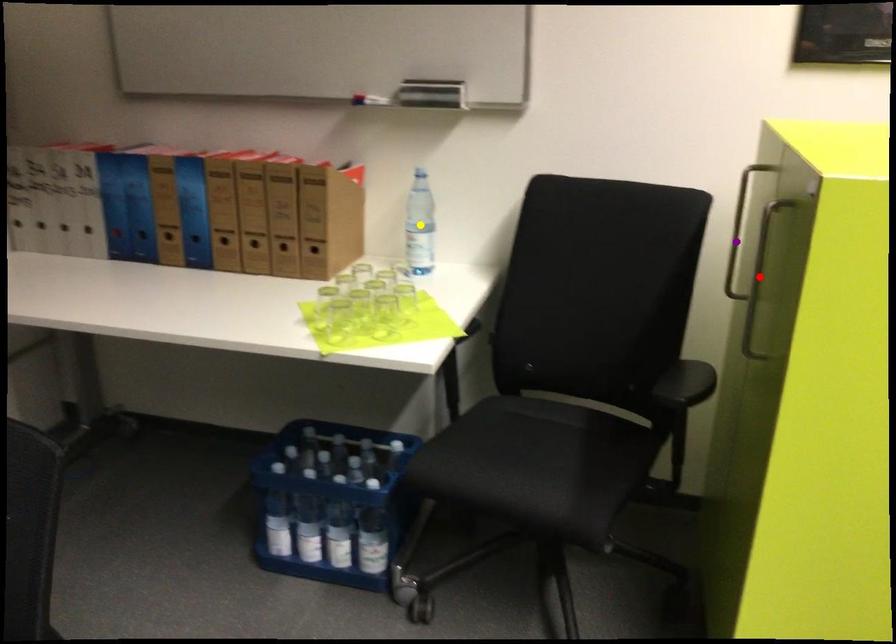
Order these from nearest to farthest:
1. yellow point
2. red point
3. purple point

red point, purple point, yellow point